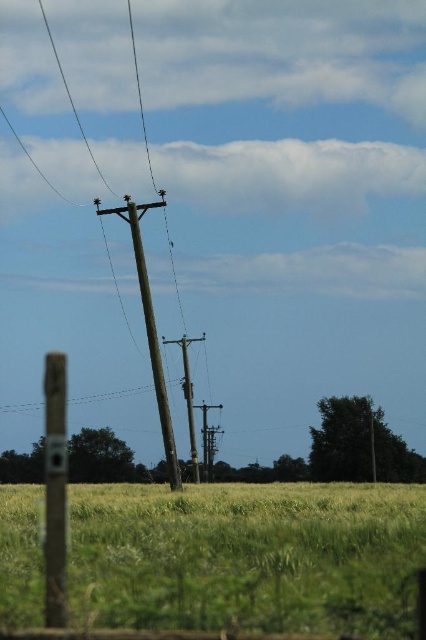
Question: Which of the following is the closest to the observer?

Choices:
 (A) brown wooden telegraph pole at center
 (B) green grassy field at lower center
 (C) smooth wood telegraph pole at center
 (D) brown wooden pole at left

Answer: (B)

Question: Is green grassy field at lower center thinner than smooth wood telegraph pole at center?

Choices:
 (A) yes
 (B) no

Answer: (B)

Question: Is green grassy field at lower center thinner than smooth wood telegraph pole at center?

Choices:
 (A) yes
 (B) no

Answer: (B)

Question: Which point appears farthest from the camera in this image?

Choices:
 (A) (167, 340)
 (B) (109, 550)
 (C) (57, 586)
 (D) (157, 339)

Answer: (A)

Question: Does green grassy field at lower center have a lesser width compared to brown wooden pole at left?

Choices:
 (A) yes
 (B) no

Answer: (B)

Question: Which point is farther from the camera taking this photo?

Choices:
 (A) (189, 416)
 (B) (150, 312)

Answer: (A)